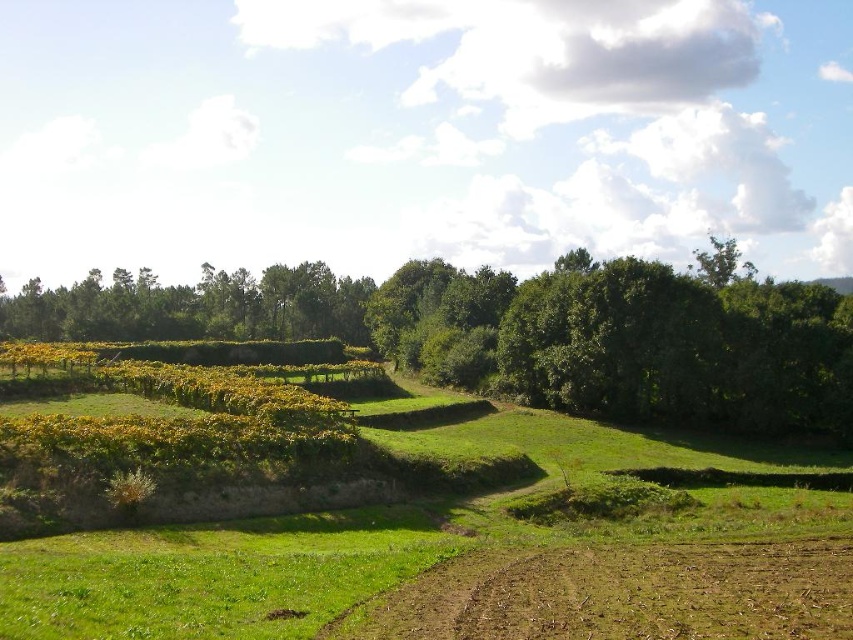
You are a farmer checking the soil quality in your field. You notice the green leafy tree at left and the brown soil at lower center. Which object is positioned higher in the image?

The green leafy tree at left is located above the brown soil at lower center, so it is positioned higher in the image.

From the picture: You are standing in the rural landscape scene and want to walk from the green leafy tree at left to the brown soil at lower center. Which direction should you move relative to the tree?

You should move towards the brown soil at lower center, which is closer to you than the green leafy tree at left. Since the tree is further away, you would need to walk forward towards the soil.

You are a gardener planning to plant a new tree in the brown soil at lower center. Considering the height of the green leafy tree at left, will the new tree potentially block sunlight to the brown soil area once it matures?

The green leafy tree at left is taller than the brown soil at lower center, so if the new tree reaches a similar or greater height, it may block sunlight. However, since the brown soil is at lower center and the tree is at left, their positions might not directly overlap in sunlight obstruction. Further assessment of their exact positions and growth patterns would be needed.